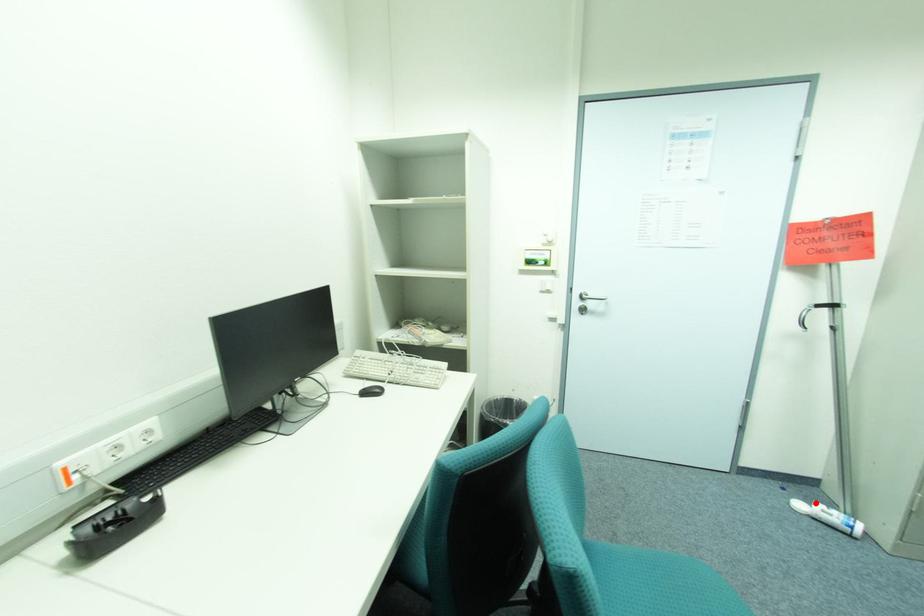
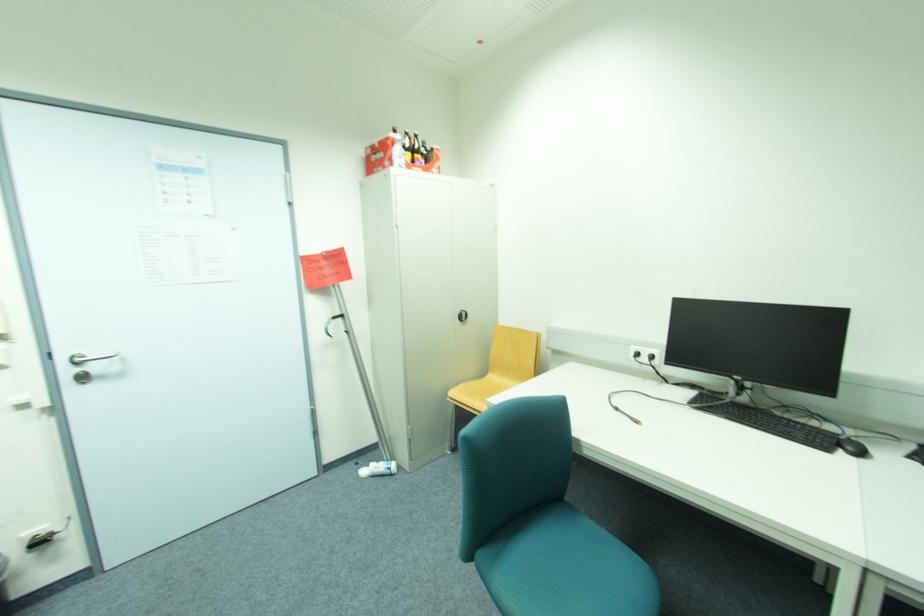
Where in the second image is the point corresponding to the highlighted location from the first image?

(373, 468)